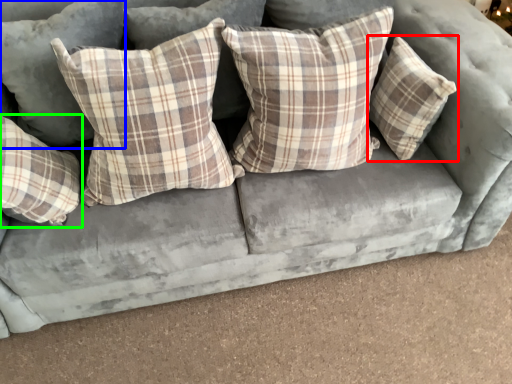
Question: Which object is positioned closest to pillow (highlighted by a red box)? Select from pillow (highlighted by a blue box) and pillow (highlighted by a green box).

Choices:
 (A) pillow
 (B) pillow

Answer: (A)